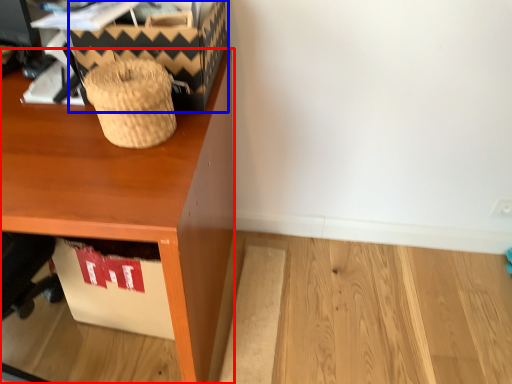
Question: Among these objects, which one is farthest to the camera, desk (highlighted by a red box) or shoe box (highlighted by a blue box)?

Choices:
 (A) desk
 (B) shoe box

Answer: (B)